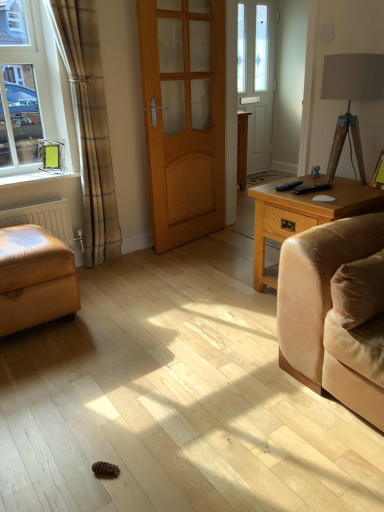
I want to click on vacant area that lies between light brown wooden side table at right and plaid fabric curtain at left, so (189, 274).